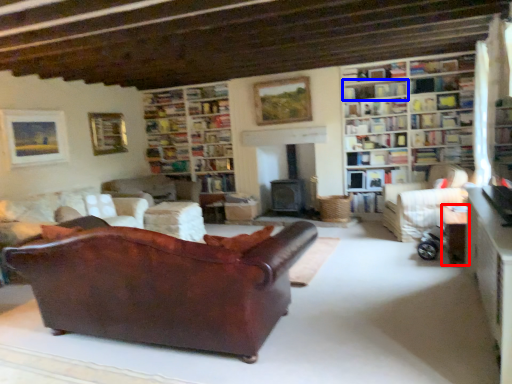
Question: Among these objects, which one is nearest to the camera, table (highlighted by a red box) or shelf (highlighted by a blue box)?

Choices:
 (A) table
 (B) shelf

Answer: (A)